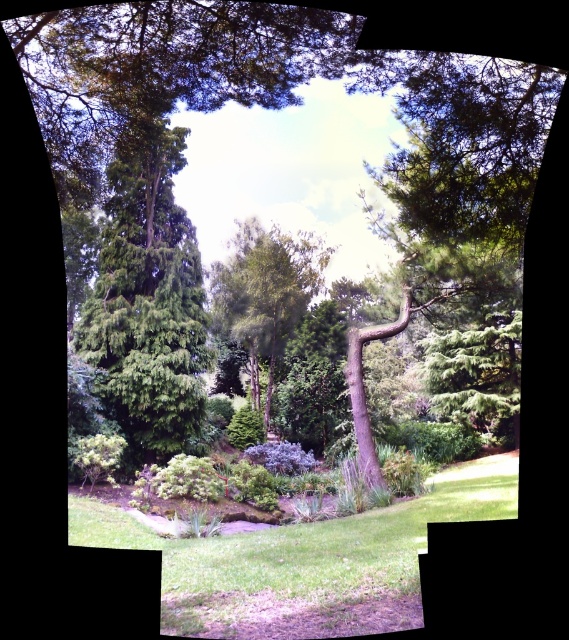
You are planning to plant a new tree in the garden. The green textured tree at left and the green leafy tree at center are already present. Which tree should you avoid planting near if you want to ensure enough sunlight reaches the new tree?

You should avoid planting near the green textured tree at left because it is taller than the green leafy tree at center, which means it will cast more shade over the new tree.

You are standing at the point with coordinates (304,561) in the garden. What is the terrain like at that location?

The terrain at point (304,561) is green grass at center.